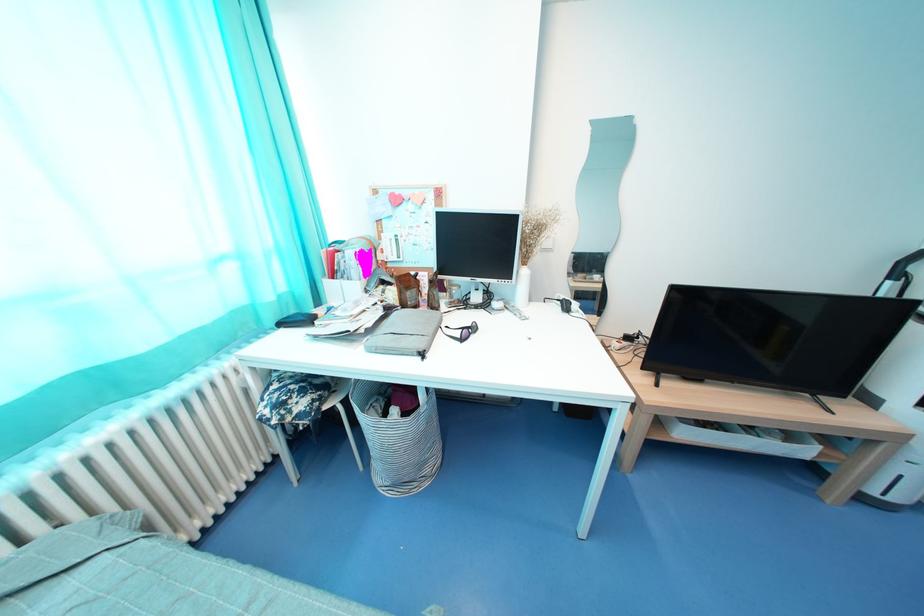
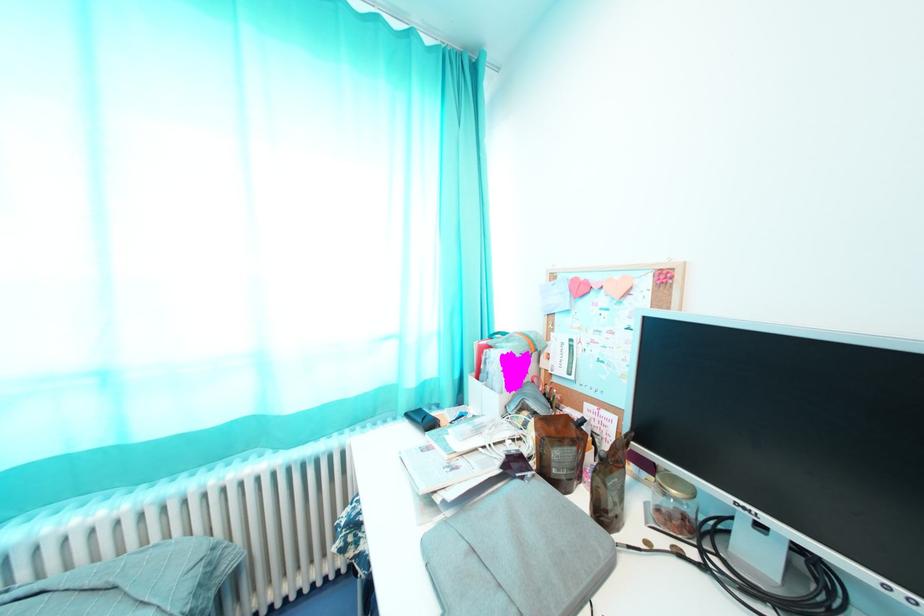
Question: The first image is from the beginning of the video and the second image is from the end. How did the camera likely rotate when shooting the video?

Choices:
 (A) Left
 (B) Right
 (C) Up
 (D) Down

Answer: (A)